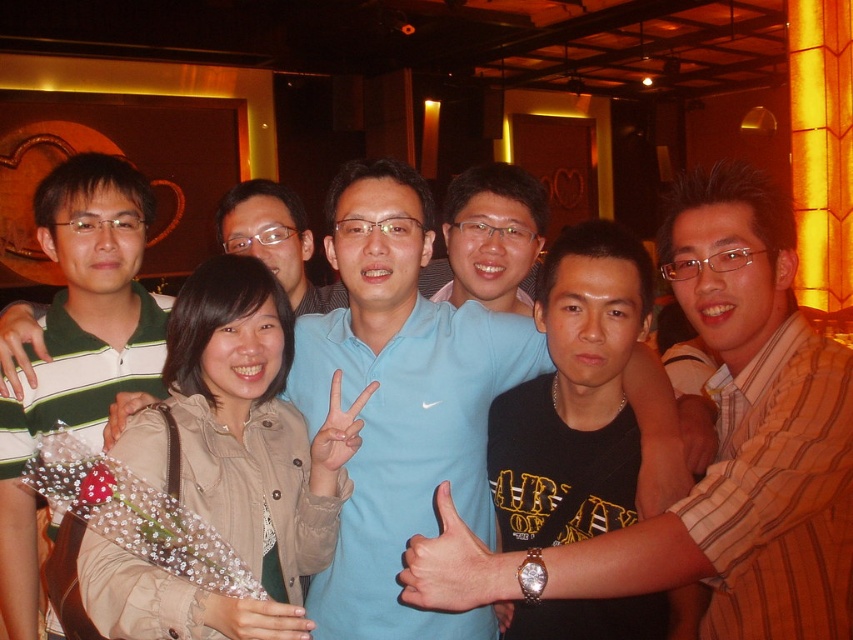
You are organizing a photo shoot and need to arrange the blue shirt at center and the tan fabric jacket at center side by side on a mannequin. Based on the image, which one should you place on the left to ensure they fit without overlapping?

The blue shirt at center is wider than the tan fabric jacket at center, so place the tan fabric jacket at center on the left and the blue shirt at center on the right to accommodate their widths without overlapping.

Where is the tan fabric jacket at center located in the image?

The tan fabric jacket at center is located at point (235, 465).

You are standing in the venue and want to take a photo of both point (x=799, y=438) and point (x=112, y=285). Which point should you focus on first to ensure both are in clear view?

You should focus on point (x=799, y=438) first because it is closer to the camera than point (x=112, y=285), ensuring both points are in focus when using depth of field.